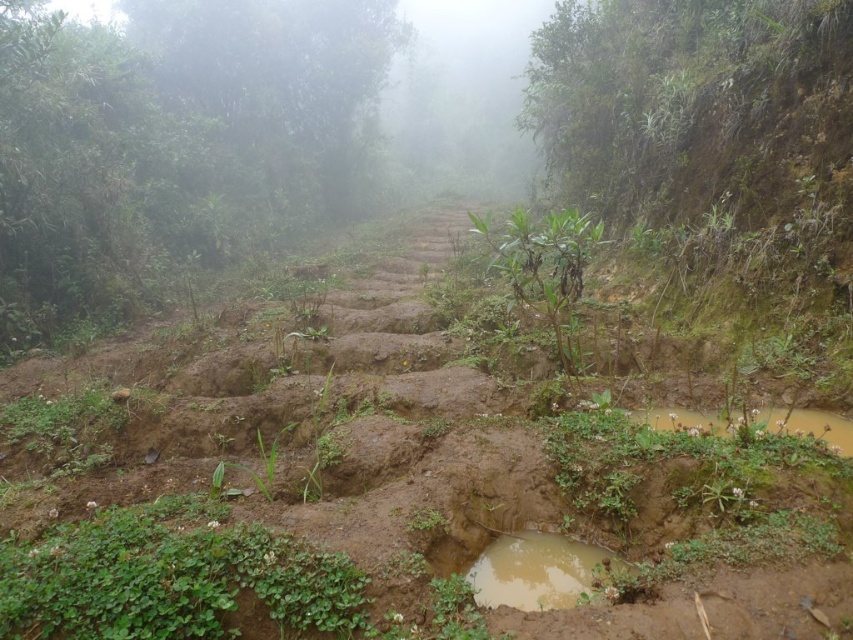
Who is positioned more to the left, green leafy plants at upper left or muddy wet puddle at lower center?

green leafy plants at upper left

Between point (65, 19) and point (554, 557), which one is positioned behind?

Positioned behind is point (65, 19).

Between point (270, 56) and point (558, 589), which one is positioned in front?

Positioned in front is point (558, 589).

Identify the location of green leafy plants at upper left. (173, 141).

Is the position of brown muddy steps at center less distant than that of muddy wet puddle at lower center?

Yes, it is in front of muddy wet puddle at lower center.

Does brown muddy steps at center have a lesser width compared to muddy wet puddle at lower center?

In fact, brown muddy steps at center might be wider than muddy wet puddle at lower center.

Is point (403, 504) farther from camera compared to point (471, 579)?

Yes.

Locate an element on the screen. brown muddy steps at center is located at coordinates (380, 490).

Who is shorter, brown muddy steps at center or green leafy plants at upper left?

→ With less height is brown muddy steps at center.

The image size is (853, 640). I want to click on brown muddy steps at center, so click(380, 490).

This screenshot has height=640, width=853. I want to click on brown muddy steps at center, so click(x=380, y=490).